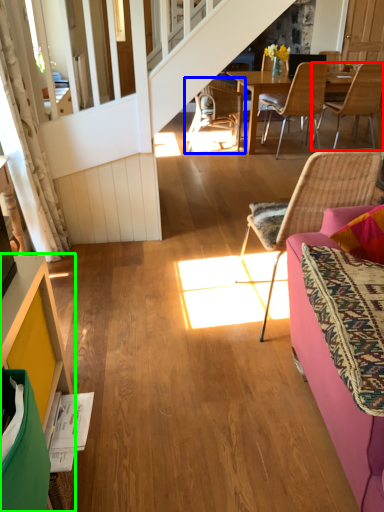
Question: Estimate the real-world distances between objects in this image. Which object is farther from chair (highlighted by a red box), chair (highlighted by a blue box) or cabinetry (highlighted by a green box)?

Choices:
 (A) chair
 (B) cabinetry

Answer: (B)